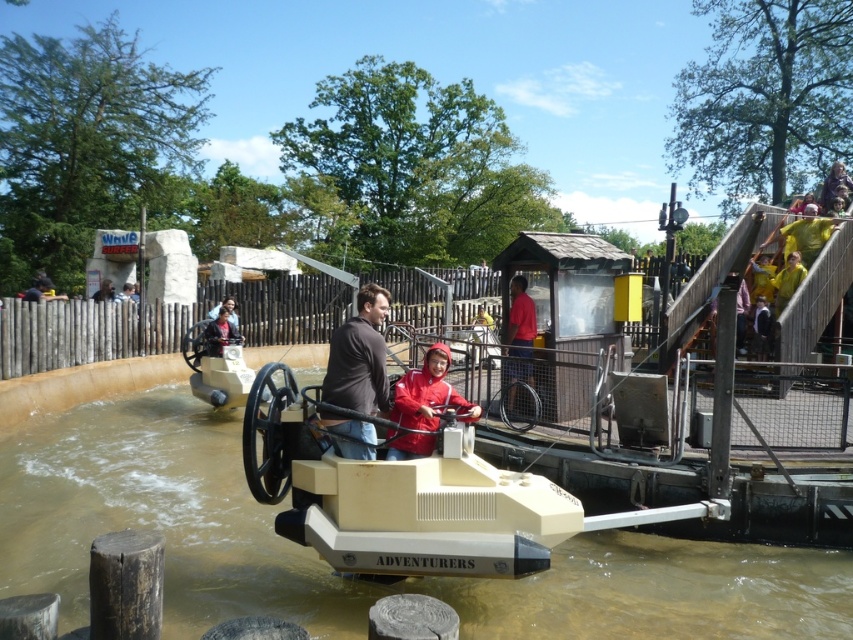
Between beige plastic boat at center and brown leather jacket at center, which one has less height?

beige plastic boat at center is shorter.

Is the position of beige plastic boat at center more distant than that of brown leather jacket at center?

No, it is in front of brown leather jacket at center.

Where is `beige plastic boat at center`? Image resolution: width=853 pixels, height=640 pixels. beige plastic boat at center is located at coordinates (341, 579).

Identify the location of beige plastic boat at center. This screenshot has width=853, height=640. (341, 579).

In the scene shown: Can you confirm if brown leather jacket at center is bigger than matte red shirt at center?

Yes.

How distant is brown leather jacket at center from matte red shirt at center?

brown leather jacket at center and matte red shirt at center are 15.05 feet apart from each other.

Is point (370, 433) positioned after point (512, 362)?

No, (370, 433) is closer to viewer.

The image size is (853, 640). What are the coordinates of `brown leather jacket at center` in the screenshot? It's located at (358, 356).

Does red matte jacket at center have a greater width compared to matte red shirt at center?

Correct, the width of red matte jacket at center exceeds that of matte red shirt at center.

Is point (426, 456) positioned after point (508, 403)?

That is False.

Locate an element on the screen. This screenshot has width=853, height=640. red matte jacket at center is located at coordinates (428, 392).